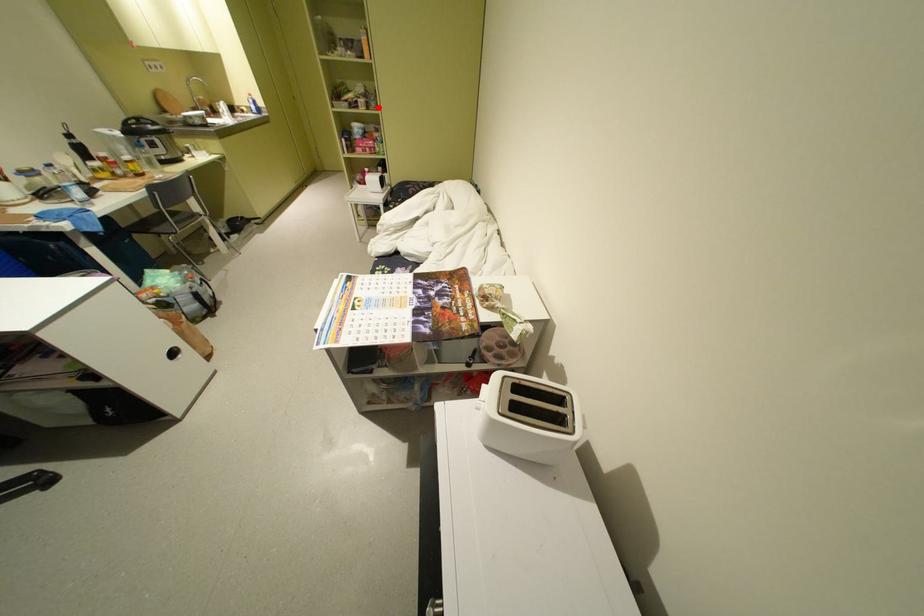
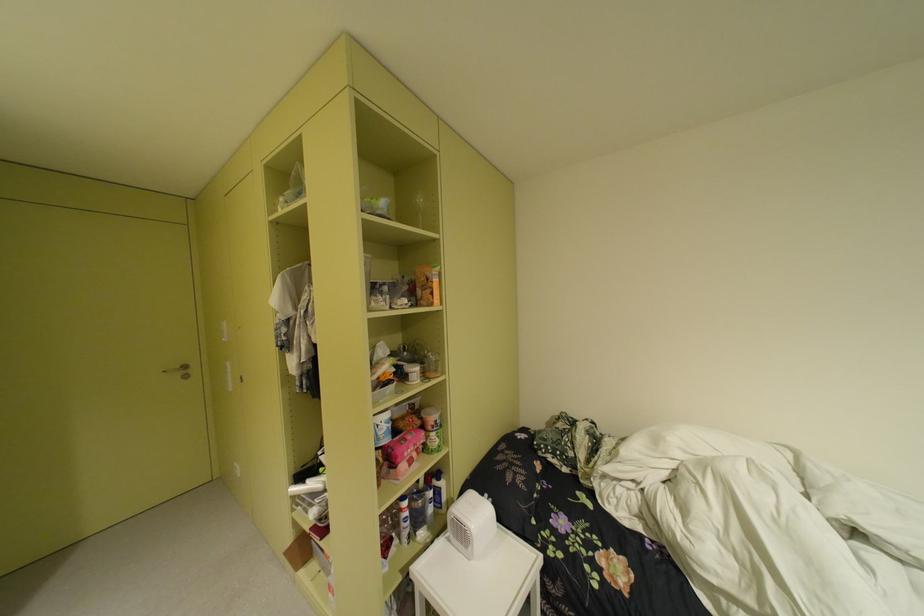
Question: I am providing you with two images of the same scene from different viewpoints. In image1, a red point is highlighted. Considering the same 3D point in image2, which of the following is correct?

Choices:
 (A) It is closer
 (B) It is farther

Answer: (B)